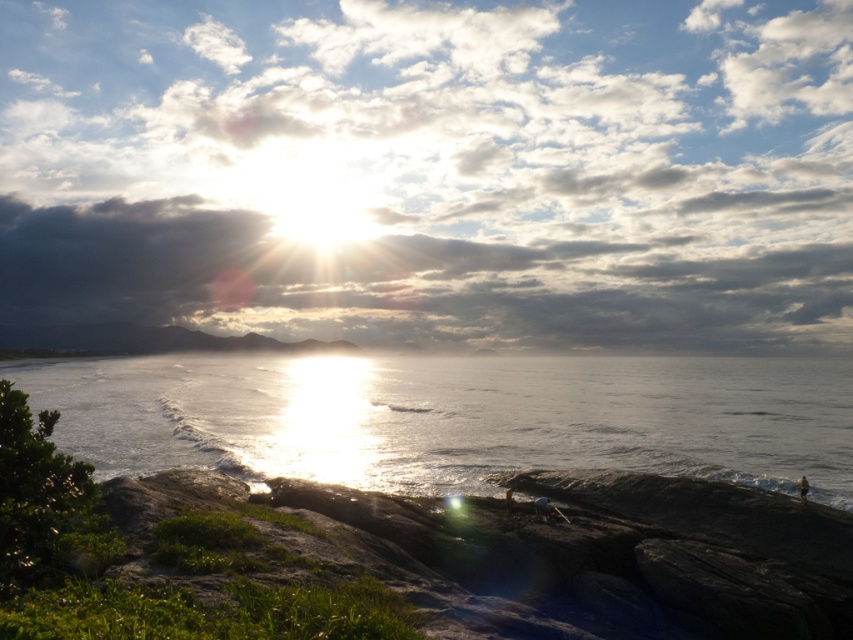
Based on the scene described, where is the point located at coordinates (433, 172)?

The point at coordinates (433, 172) corresponds to the cloudy sky at upper center.

You are a photographer standing at the shore and want to capture both the point at coordinates point [292,51] and point [408,429] in your photo. Which point will appear closer to the front of the image?

Point [292,51] is further to the camera than point [408,429], so it will appear closer to the front of the image.